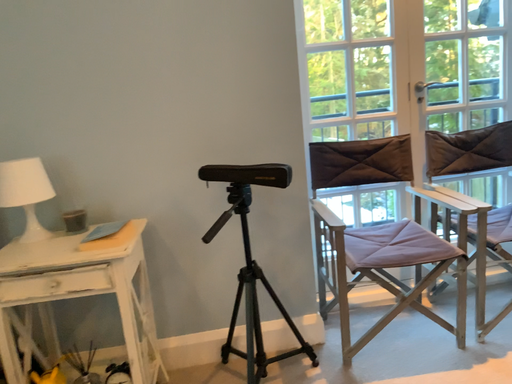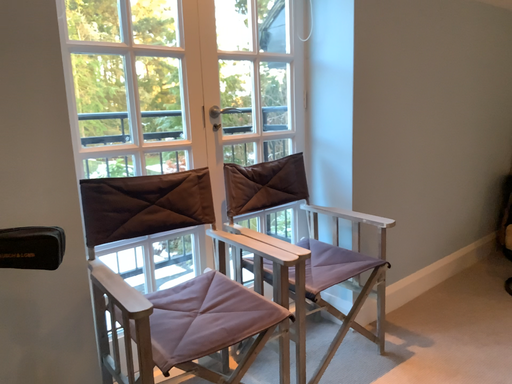
Question: How did the camera likely rotate when shooting the video?

Choices:
 (A) rotated left
 (B) rotated right

Answer: (B)